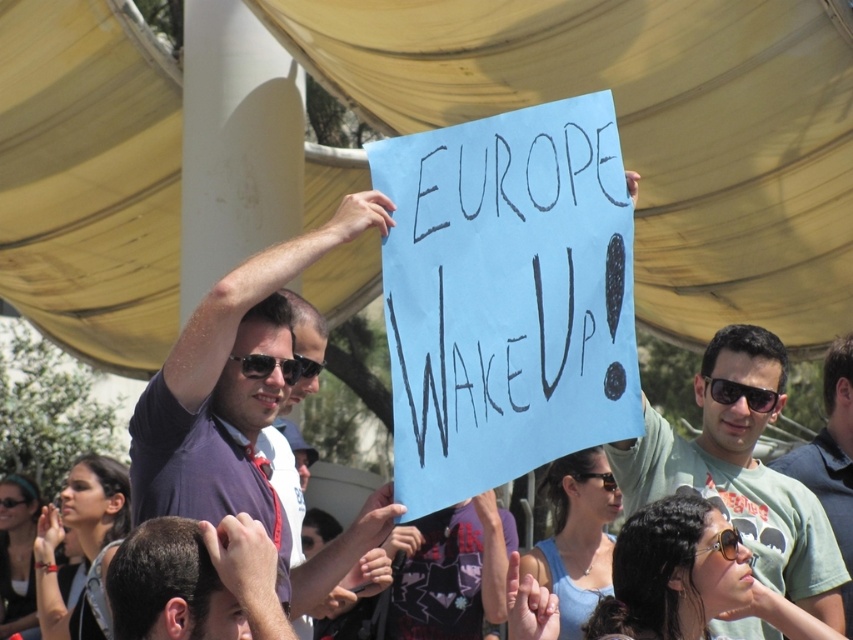
Can you confirm if matte purple shirt at center is positioned above dark brown hair at center?

Yes, matte purple shirt at center is above dark brown hair at center.

Can you confirm if matte purple shirt at center is wider than dark brown hair at center?

Indeed, matte purple shirt at center has a greater width compared to dark brown hair at center.

Which is in front, point (151, 474) or point (213, 531)?

Point (213, 531) is more forward.

Find the location of `matte purple shirt at center`. matte purple shirt at center is located at coordinates (244, 410).

Who is higher up, black plastic sunglasses at center or black plastic goggles at upper center?

black plastic goggles at upper center is higher up.

Image resolution: width=853 pixels, height=640 pixels. What do you see at coordinates (723, 544) in the screenshot? I see `black plastic sunglasses at center` at bounding box center [723, 544].

Who is more distant from viewer, [729,560] or [306,356]?

Point [306,356]

You are a GUI agent. You are given a task and a screenshot of the screen. Output one action in this format:
    pyautogui.click(x=<x>, y=<y>)
    Task: Click on the black plastic sunglasses at center
    The image size is (853, 640).
    Given the screenshot: What is the action you would take?
    pyautogui.click(x=723, y=544)

Can you confirm if matte purple shirt at center is bigger than sunglasses at center?

Yes.

Who is more distant from viewer, (231, 400) or (728, 403)?

The point (728, 403) is more distant.

Describe the element at coordinates (244, 410) in the screenshot. I see `matte purple shirt at center` at that location.

You are a GUI agent. You are given a task and a screenshot of the screen. Output one action in this format:
    pyautogui.click(x=<x>, y=<y>)
    Task: Click on the matte purple shirt at center
    This screenshot has height=640, width=853.
    Given the screenshot: What is the action you would take?
    pyautogui.click(x=244, y=410)